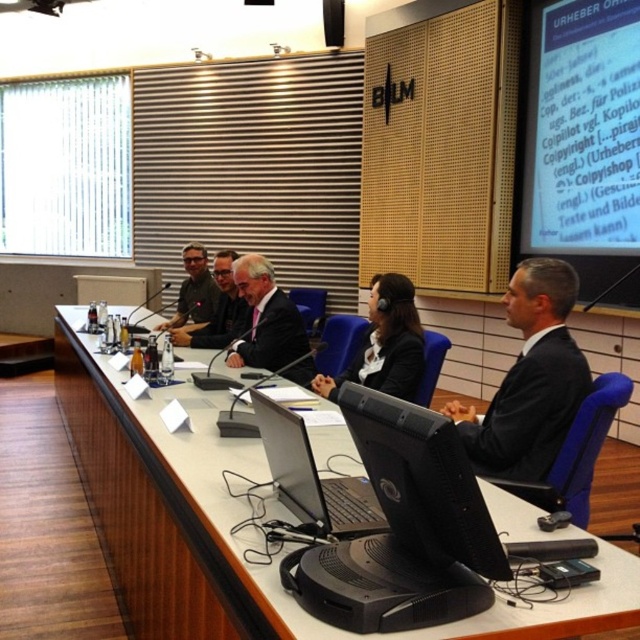
Who is more distant from viewer, (513,324) or (182,257)?

Point (182,257)

What do you see at coordinates (529, 380) in the screenshot?
I see `dark suit at center` at bounding box center [529, 380].

Where is `dark suit at center`? dark suit at center is located at coordinates (529, 380).

Who is taller, dark suit at center or dark gray suit at center?

With more height is dark suit at center.

Can you confirm if dark suit at center is positioned to the right of dark gray suit at center?

Indeed, dark suit at center is positioned on the right side of dark gray suit at center.

Between point (481, 461) and point (243, 300), which one is positioned in front?

Point (481, 461) is in front.

Identify the location of dark suit at center. (529, 380).

Between white glossy table at center and black plastic laptop at center, which one is positioned higher?

black plastic laptop at center is above.

From the picture: Can you confirm if white glossy table at center is taller than black plastic laptop at center?

Yes, white glossy table at center is taller than black plastic laptop at center.

Between point (86, 451) and point (401, 529), which one is positioned in front?

Point (401, 529) is in front.

In order to click on white glossy table at center in this screenshot , I will do `click(237, 520)`.